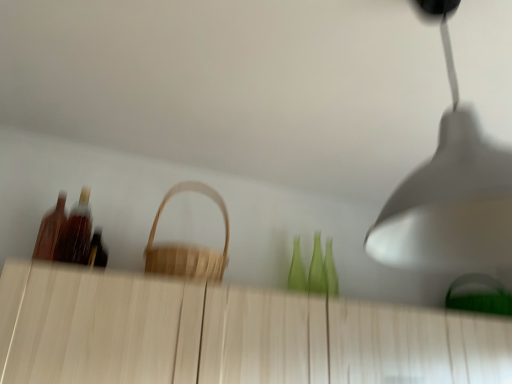
Question: Is light wood dresser at center at the left side of shiny brown bottle at left, acting as the second bottle starting from the left?

Choices:
 (A) no
 (B) yes

Answer: (A)

Question: Does light wood dresser at center appear on the right side of shiny brown bottle at left, acting as the second bottle starting from the left?

Choices:
 (A) no
 (B) yes

Answer: (B)

Question: Is the position of light wood dresser at center more distant than that of shiny brown bottle at left, the first bottle from the right?

Choices:
 (A) no
 (B) yes

Answer: (A)

Question: From the image's perspective, is light wood dresser at center above shiny brown bottle at left, acting as the second bottle starting from the left?

Choices:
 (A) no
 (B) yes

Answer: (A)

Question: From the image's perspective, is light wood dresser at center below shiny brown bottle at left, the first bottle from the right?

Choices:
 (A) yes
 (B) no

Answer: (A)

Question: Can you confirm if light wood dresser at center is thinner than shiny brown bottle at left, acting as the second bottle starting from the left?

Choices:
 (A) no
 (B) yes

Answer: (A)

Question: Does white matte lampshade at upper right have a lesser height compared to shiny brown bottle at left, acting as the second bottle starting from the left?

Choices:
 (A) yes
 (B) no

Answer: (B)

Question: From the image's perspective, is white matte lampshade at upper right below shiny brown bottle at left, acting as the second bottle starting from the left?

Choices:
 (A) yes
 (B) no

Answer: (B)

Question: Is white matte lampshade at upper right wider than shiny brown bottle at left, the first bottle from the right?

Choices:
 (A) yes
 (B) no

Answer: (A)

Question: Does white matte lampshade at upper right have a greater height compared to shiny brown bottle at left, the first bottle from the right?

Choices:
 (A) no
 (B) yes

Answer: (B)

Question: Is shiny brown bottle at left, acting as the second bottle starting from the left, surrounded by white matte lampshade at upper right?

Choices:
 (A) no
 (B) yes

Answer: (A)

Question: Are white matte lampshade at upper right and shiny brown bottle at left, acting as the second bottle starting from the left, located far from each other?

Choices:
 (A) no
 (B) yes

Answer: (B)

Question: Does natural wood basket at center have a greater height compared to white matte lampshade at upper right?

Choices:
 (A) no
 (B) yes

Answer: (A)